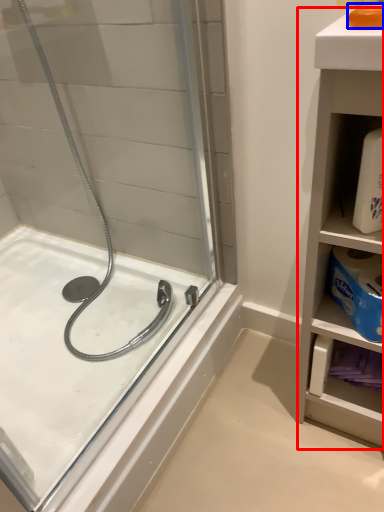
Question: Among these objects, which one is nearest to the camera, bathroom cabinet (highlighted by a red box) or soap (highlighted by a blue box)?

Choices:
 (A) bathroom cabinet
 (B) soap

Answer: (A)